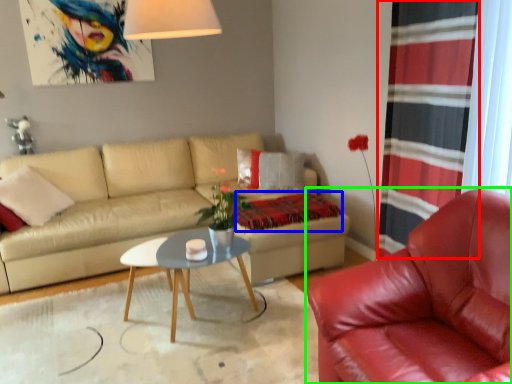
Question: Estimate the real-world distances between objects in this image. Which object is closer to curtain (highlighted by a red box), blanket (highlighted by a blue box) or chair (highlighted by a green box)?

Choices:
 (A) blanket
 (B) chair

Answer: (B)